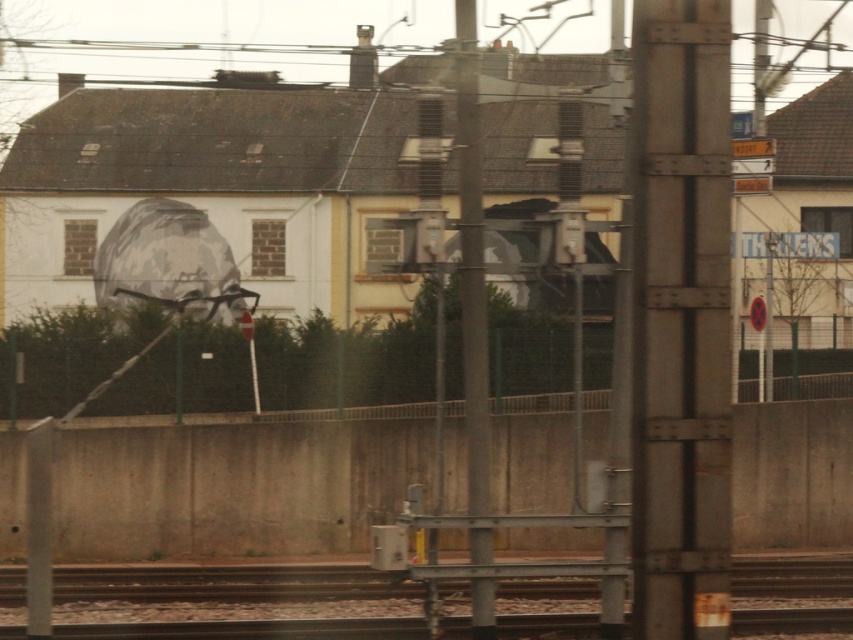
Does smooth metal train track at center appear on the right side of metallic gray pole at center?

Incorrect, smooth metal train track at center is not on the right side of metallic gray pole at center.

From the picture: Measure the distance from smooth metal train track at center to metallic gray pole at center.

The distance of smooth metal train track at center from metallic gray pole at center is 5.23 meters.

Is point (753, 564) less distant than point (479, 577)?

No, (753, 564) is further to viewer.

Image resolution: width=853 pixels, height=640 pixels. Identify the location of smooth metal train track at center. (227, 582).

What do you see at coordinates (680, 320) in the screenshot? I see `rusty metal pole at center` at bounding box center [680, 320].

Does rusty metal pole at center have a larger size compared to smooth metal train track at center?

No, rusty metal pole at center is not bigger than smooth metal train track at center.

Which is behind, point (643, 157) or point (846, 566)?

The point (846, 566) is behind.

The image size is (853, 640). Find the location of `rusty metal pole at center`. rusty metal pole at center is located at coordinates (680, 320).

Who is positioned more to the left, rusty metal pole at center or metallic gray pole at center?

Positioned to the left is metallic gray pole at center.

Between rusty metal pole at center and metallic gray pole at center, which one has more height?

metallic gray pole at center is taller.

Describe the element at coordinates (680, 320) in the screenshot. The image size is (853, 640). I see `rusty metal pole at center` at that location.

This screenshot has width=853, height=640. Identify the location of rusty metal pole at center. (680, 320).